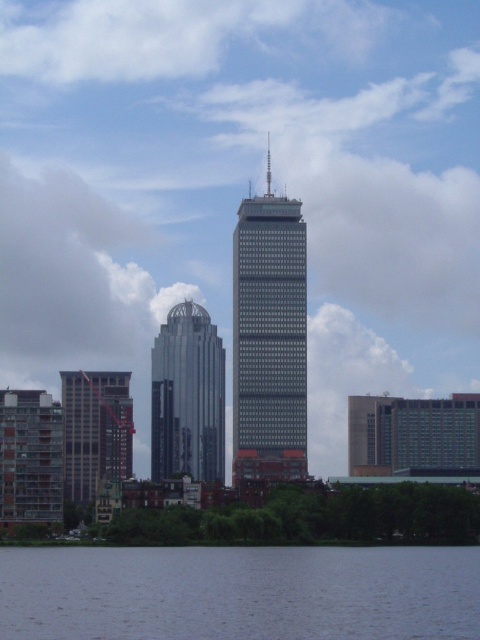
Who is taller, blue water at lower center or gray glass skyscraper at center?

Standing taller between the two is gray glass skyscraper at center.

The width and height of the screenshot is (480, 640). Describe the element at coordinates (240, 593) in the screenshot. I see `blue water at lower center` at that location.

The image size is (480, 640). In order to click on blue water at lower center in this screenshot , I will do `click(240, 593)`.

Identify the location of blue water at lower center. (240, 593).

Can you confirm if gray glass skyscraper at center is positioned to the left of glassy concrete building at lower left?

In fact, gray glass skyscraper at center is to the right of glassy concrete building at lower left.

I want to click on gray glass skyscraper at center, so click(268, 337).

Is gray concrete building at left thinner than glassy concrete building at lower left?

No, gray concrete building at left is not thinner than glassy concrete building at lower left.

Can you confirm if gray concrete building at left is wider than glassy concrete building at lower left?

Indeed, gray concrete building at left has a greater width compared to glassy concrete building at lower left.

The height and width of the screenshot is (640, 480). What are the coordinates of `gray concrete building at left` in the screenshot? It's located at (95, 432).

Where is `gray concrete building at left`? The width and height of the screenshot is (480, 640). gray concrete building at left is located at coordinates (95, 432).